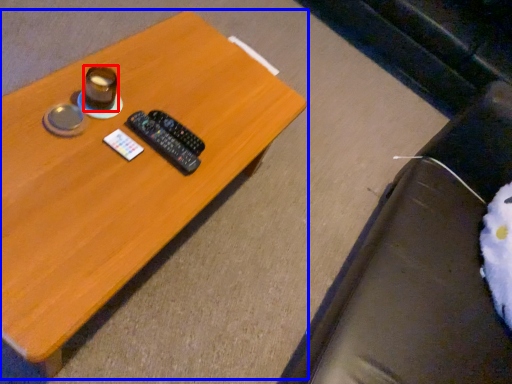
Question: Among these objects, which one is farthest to the camera, coffee cup (highlighted by a red box) or table (highlighted by a blue box)?

Choices:
 (A) coffee cup
 (B) table

Answer: (A)